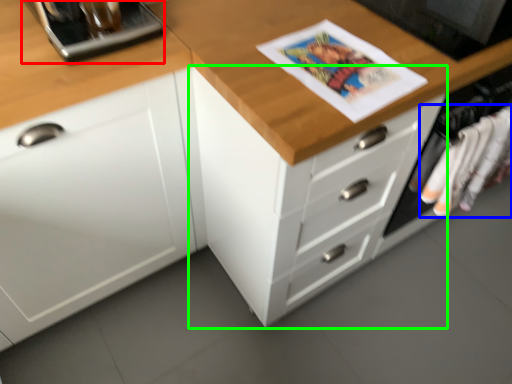
Question: Based on their relative distances, which object is nearer to appliance (highlighted by a red box)? Choose from clothing (highlighted by a blue box) and chest of drawers (highlighted by a green box).

Choices:
 (A) clothing
 (B) chest of drawers

Answer: (B)